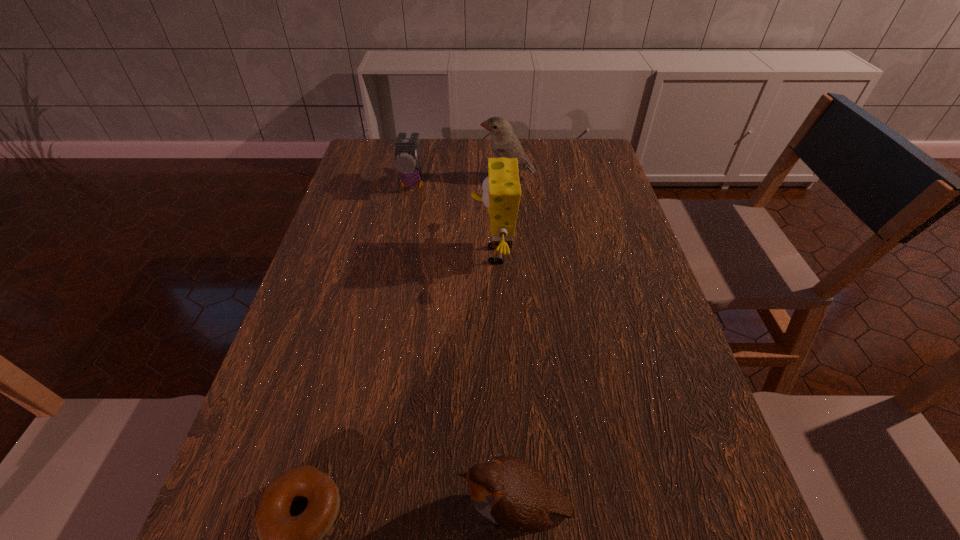
Locate an element on the screen. The height and width of the screenshot is (540, 960). the closest bird to the leftmost bird is located at coordinates (504, 143).